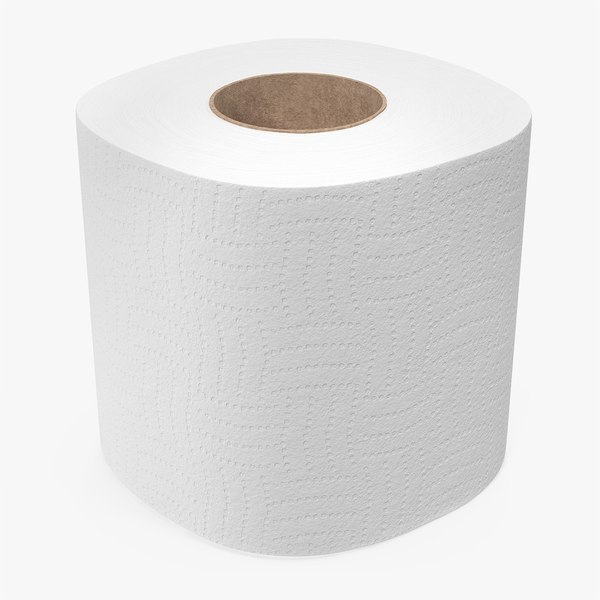
Locate an element on the screen. This screenshot has width=600, height=600. cardboard roll is located at coordinates (298, 95).